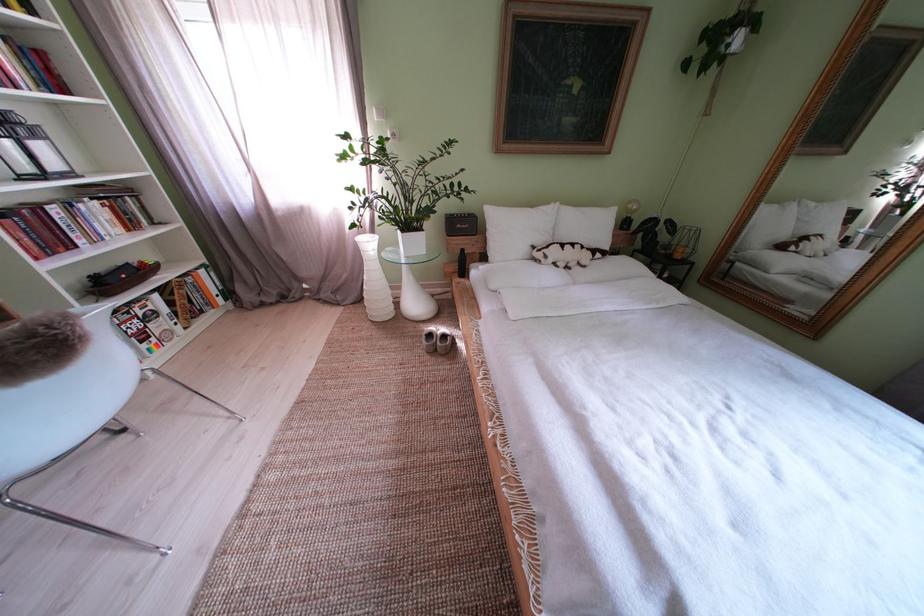
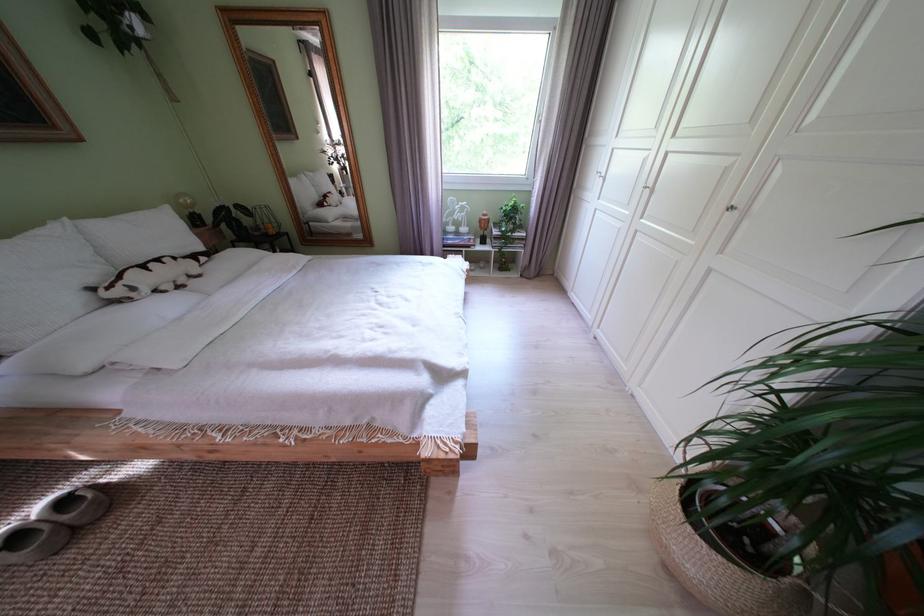
Locate, in the second image, the point that corresponds to the point at 442,341 in the first image.

(28, 543)